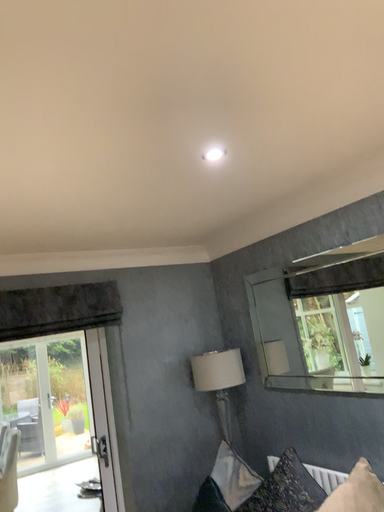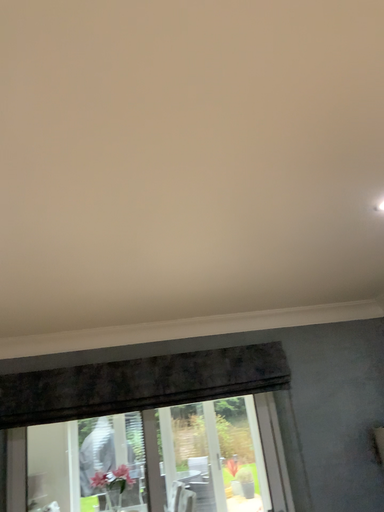
Question: How did the camera likely rotate when shooting the video?

Choices:
 (A) rotated right
 (B) rotated left

Answer: (B)